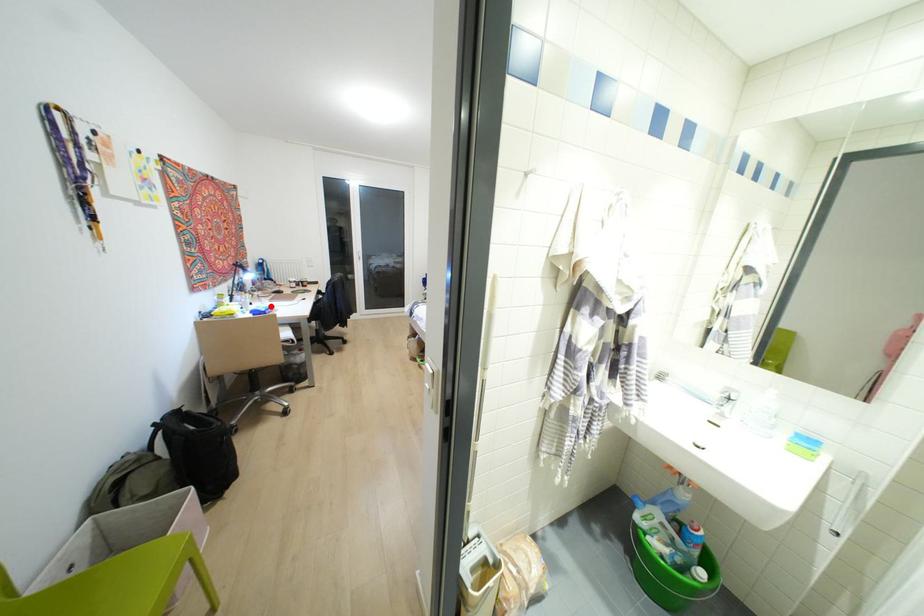
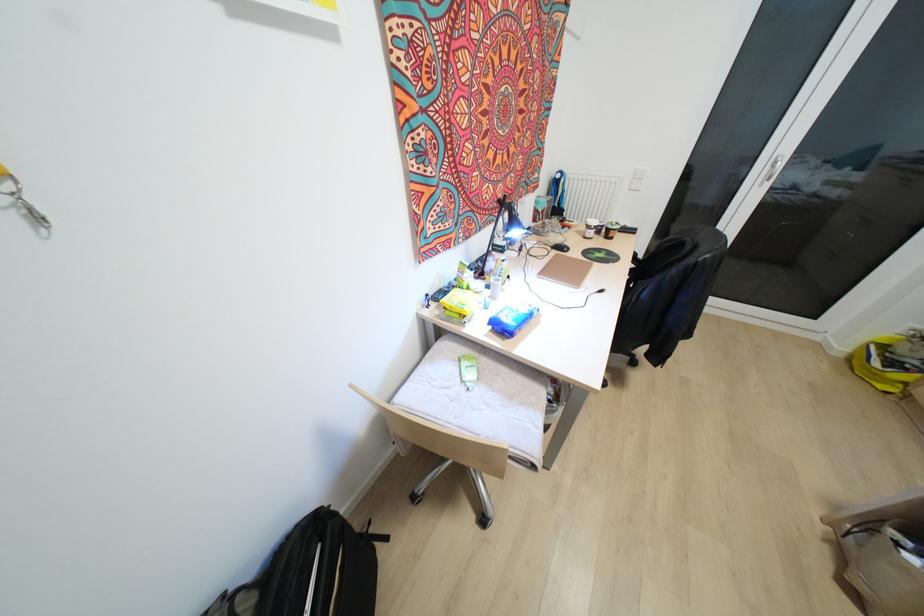
Where in the second image is the point corresponding to the highlighted location from the first image?

(529, 314)